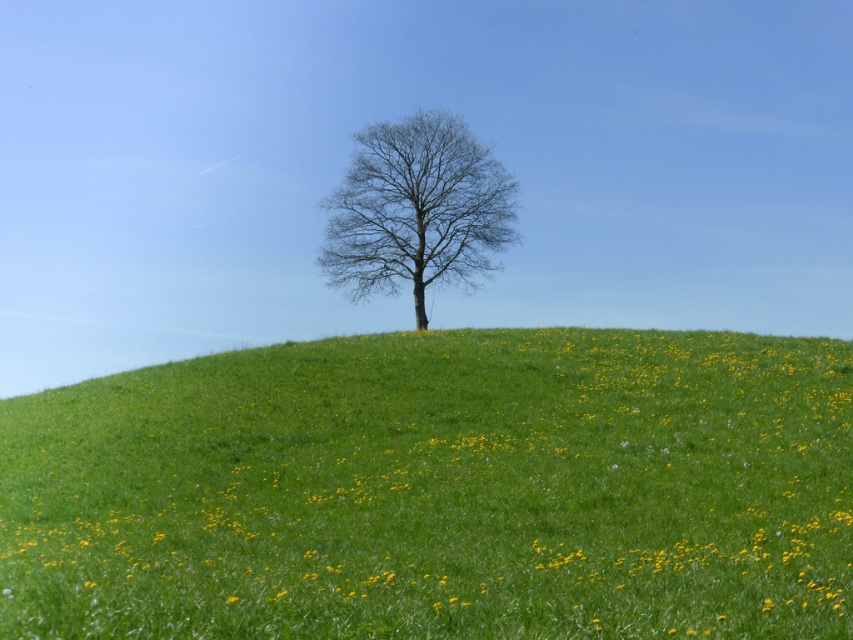
You are a hiker trying to estimate distances in the landscape. You see the green grassy hillside at center and the bare branches at center. How far apart are these two features?

The green grassy hillside at center is 21.11 meters from the bare branches at center.

You are standing at the base of the leafless tree on the green hill and want to place a small flag exactly at the point marked by the coordinates point (x=439, y=490). According to the image, where should you place the flag?

The point (x=439, y=490) indicates the green grassy hillside at center, so you should place the flag on the green grassy hillside at center.